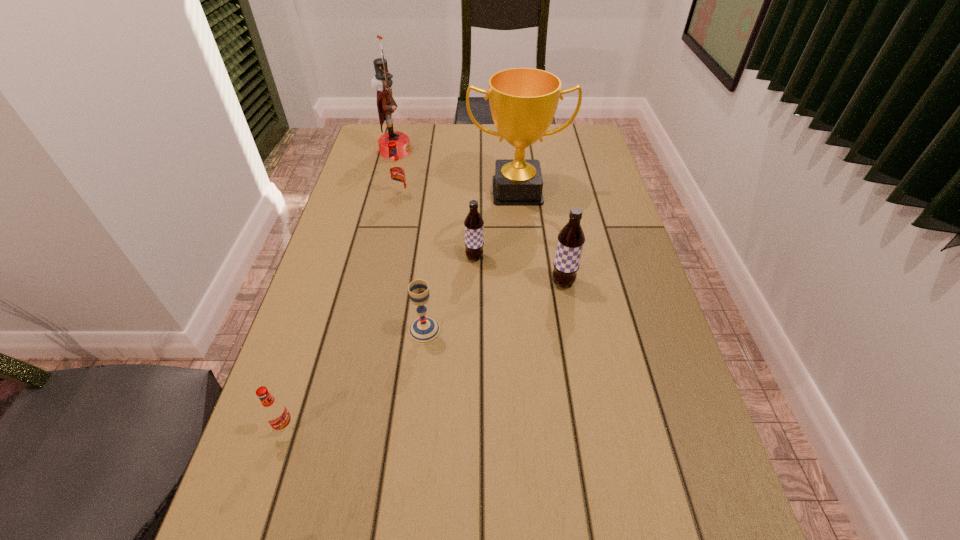
Where is `free space in the image that satisfies the following two spatial constraints: 1. on the front-facing side of the farther brown root beer; 2. on the left side of the red nutcracker`? This screenshot has width=960, height=540. free space in the image that satisfies the following two spatial constraints: 1. on the front-facing side of the farther brown root beer; 2. on the left side of the red nutcracker is located at coordinates (369, 258).

This screenshot has width=960, height=540. Identify the location of vacant space that satisfies the following two spatial constraints: 1. on the front-facing side of the red nutcracker; 2. on the left side of the left brown root beer. (369, 258).

What are the coordinates of `vacant space that satisfies the following two spatial constraints: 1. on the front-facing side of the red nutcracker; 2. on the front side of the shortest root beer` in the screenshot? It's located at (324, 427).